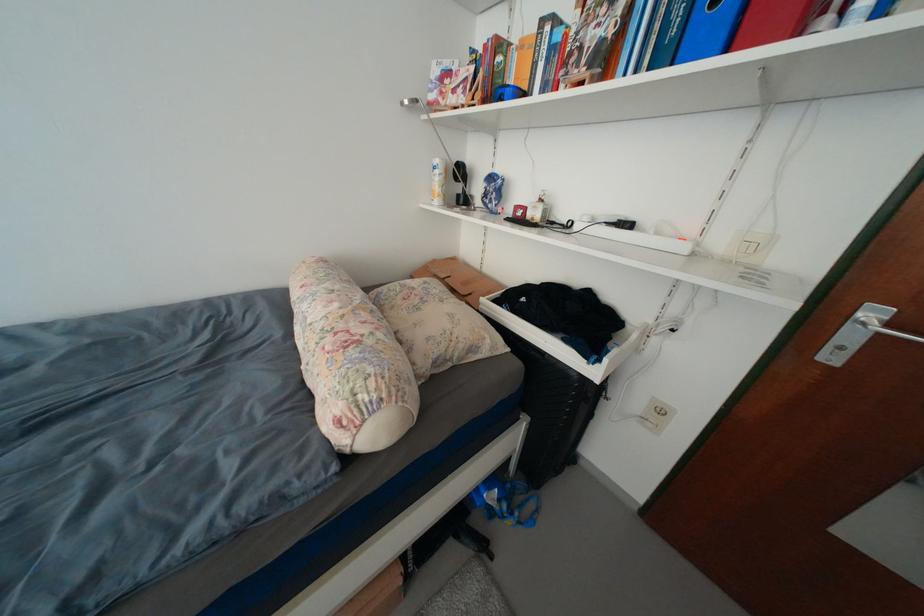
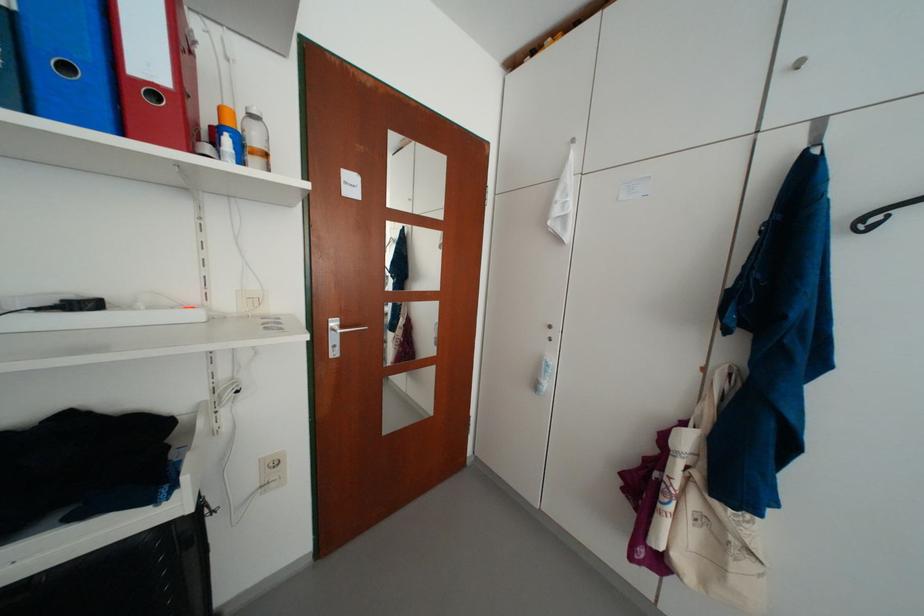
In the second image, find the point that corresponds to the point at 736,53 in the first image.

(130, 136)